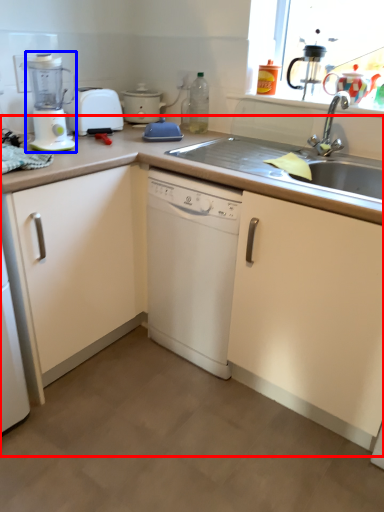
Question: Which object appears closest to the camera in this image, counter (highlighted by a red box) or kitchen appliance (highlighted by a blue box)?

Choices:
 (A) counter
 (B) kitchen appliance

Answer: (A)